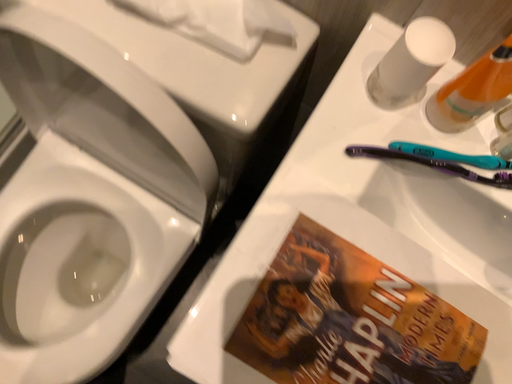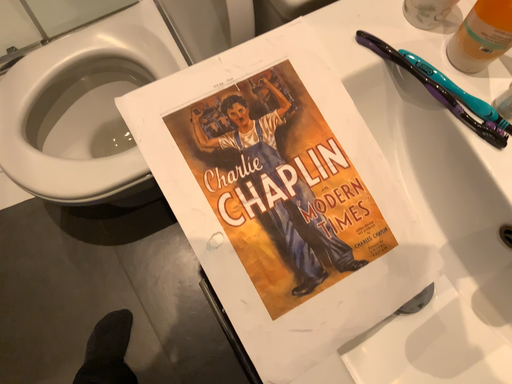
Question: Which way did the camera rotate in the video?

Choices:
 (A) rotated upward
 (B) rotated downward

Answer: (A)